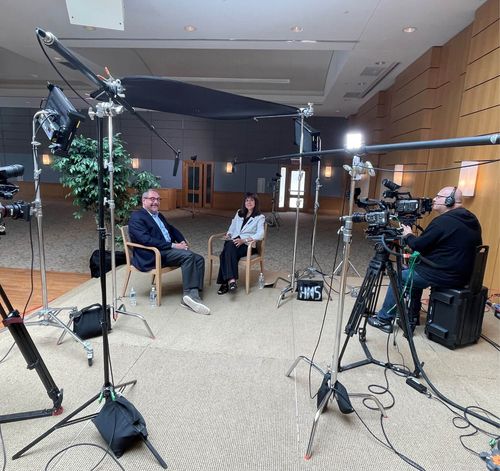
Where is `fake plant leaves`? This screenshot has width=500, height=471. fake plant leaves is located at coordinates (81, 165), (146, 176), (89, 183), (86, 144).